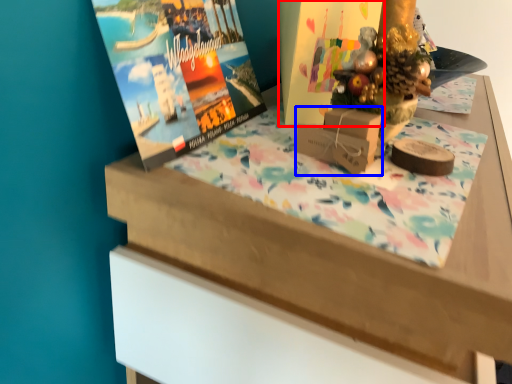
Question: Which object is further to the camera taking this photo, book cover (highlighted by a red box) or cardboard box (highlighted by a blue box)?

Choices:
 (A) book cover
 (B) cardboard box

Answer: (A)